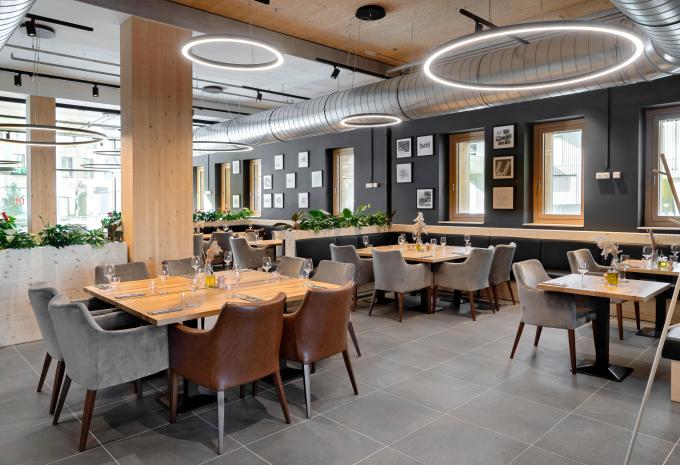
Find the location of a particular element. This screenshot has height=465, width=680. small windows is located at coordinates (673, 146), (564, 148), (469, 153), (345, 173), (258, 183), (224, 183), (200, 184).